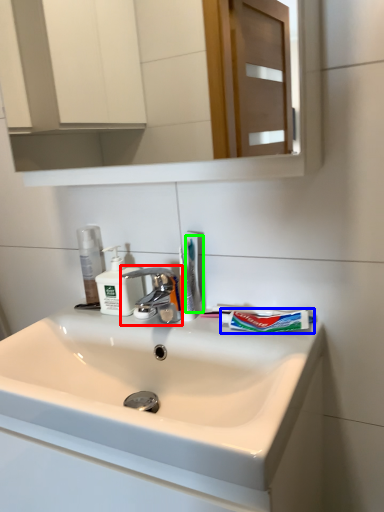
Question: Estimate the real-world distances between objects in this image. Which object is closer to tap (highlighted by a red box), toothpaste (highlighted by a blue box) or toothbrush (highlighted by a green box)?

Choices:
 (A) toothpaste
 (B) toothbrush

Answer: (B)